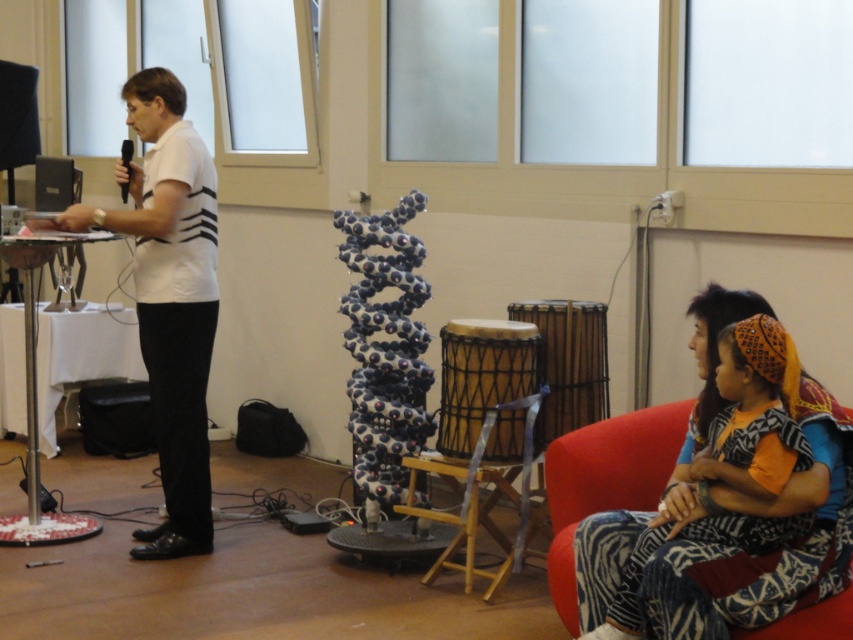
Is white matte shirt at center below black plastic microphone at upper left?

Indeed, white matte shirt at center is positioned under black plastic microphone at upper left.

Is point (112, 211) more distant than point (125, 200)?

No, (112, 211) is in front of (125, 200).

You are a GUI agent. You are given a task and a screenshot of the screen. Output one action in this format:
    pyautogui.click(x=<x>, y=<y>)
    Task: Click on the white matte shirt at center
    This screenshot has height=640, width=853.
    Given the screenshot: What is the action you would take?
    pyautogui.click(x=170, y=298)

Between white matte shirt at center and velvet fabric armchair at lower right, which one is positioned lower?

velvet fabric armchair at lower right is below.

Is white matte shirt at center taller than velvet fabric armchair at lower right?

Correct, white matte shirt at center is much taller as velvet fabric armchair at lower right.

The width and height of the screenshot is (853, 640). I want to click on white matte shirt at center, so click(170, 298).

Where is `white matte shirt at center`? white matte shirt at center is located at coordinates (170, 298).

Which is more to the left, velvet fabric armchair at lower right or black plastic microphone at upper left?

black plastic microphone at upper left is more to the left.

Can you confirm if velvet fabric armchair at lower right is shorter than black plastic microphone at upper left?

No, velvet fabric armchair at lower right is not shorter than black plastic microphone at upper left.

The height and width of the screenshot is (640, 853). Describe the element at coordinates (605, 481) in the screenshot. I see `velvet fabric armchair at lower right` at that location.

Where is `velvet fabric armchair at lower right`? The image size is (853, 640). velvet fabric armchair at lower right is located at coordinates (605, 481).